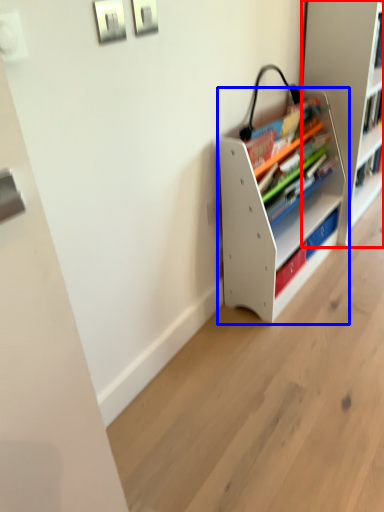
Question: Which object appears closest to the camera in this image, shelf (highlighted by a red box) or shelf (highlighted by a blue box)?

Choices:
 (A) shelf
 (B) shelf

Answer: (B)